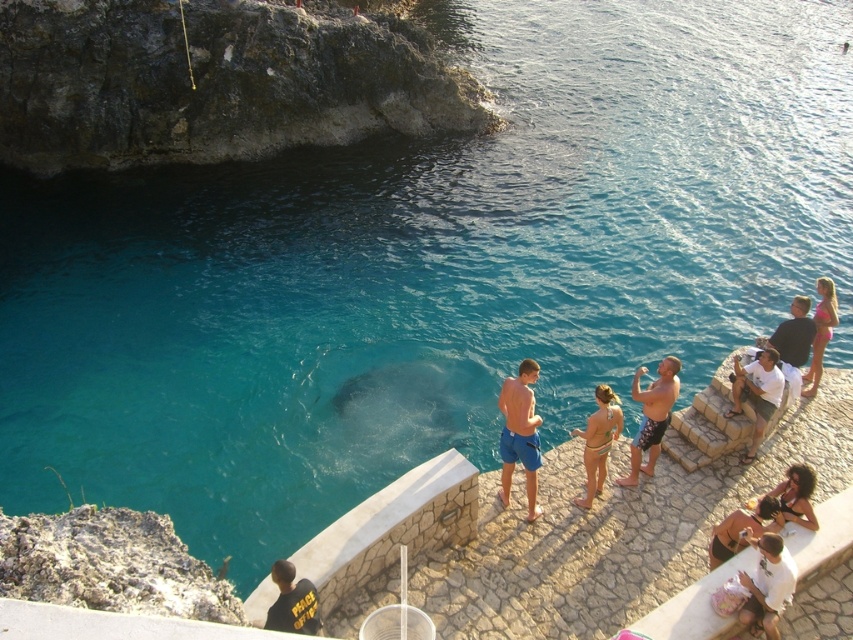
Question: In this image, where is blue fabric shorts at center located relative to dark blue shirt at lower left?

Choices:
 (A) below
 (B) above

Answer: (B)

Question: Does printed swim trunks at center have a greater width compared to pink fabric bikini at lower right?

Choices:
 (A) no
 (B) yes

Answer: (B)

Question: Which point is closer to the camera taking this photo?

Choices:
 (A) (631, 396)
 (B) (798, 300)

Answer: (A)

Question: Which of the following is the farthest from the observer?

Choices:
 (A) dark brown hair at lower right
 (B) white cotton shirt at lower right
 (C) blue fabric shorts at center
 (D) white cotton shirt at right

Answer: (D)

Question: Which object appears closest to the camera in this image?

Choices:
 (A) dark brown hair at lower right
 (B) printed swim trunks at center

Answer: (A)

Question: Is blue fabric shorts at center smaller than dark brown hair at lower right?

Choices:
 (A) no
 (B) yes

Answer: (A)